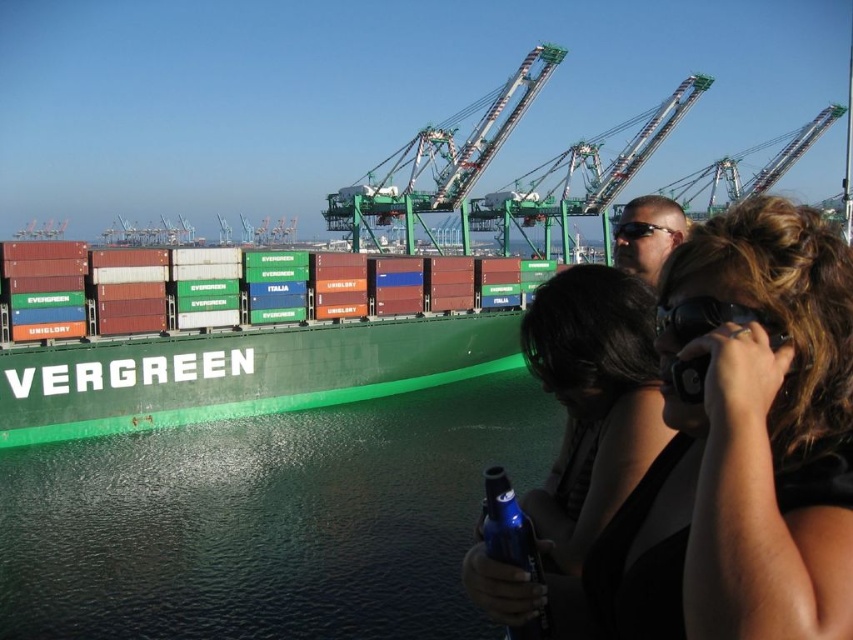
From the picture: You are a photographer standing at the port and want to take a photo of the green matte container ship at center and the matte black hair at center. According to the scene, which object should be placed to the left in your photo?

The green matte container ship at center is positioned on the left side of matte black hair at center, so in your photo, the green matte container ship at center should be placed to the left of the matte black hair at center.

You are a photographer standing on the dock and want to capture the reflection of the cargo ship in the water. You have a pair of matte black sunglasses at center. Where should you position yourself relative to the green glossy water at lower center to ensure the reflection is visible in your shot?

To capture the reflection of the cargo ship in the water, you should position yourself above the green glossy water at lower center, as the reflection would be visible on its surface. The matte black sunglasses at center are located above the water, so positioning yourself there allows you to look downward toward the water to see the reflection.